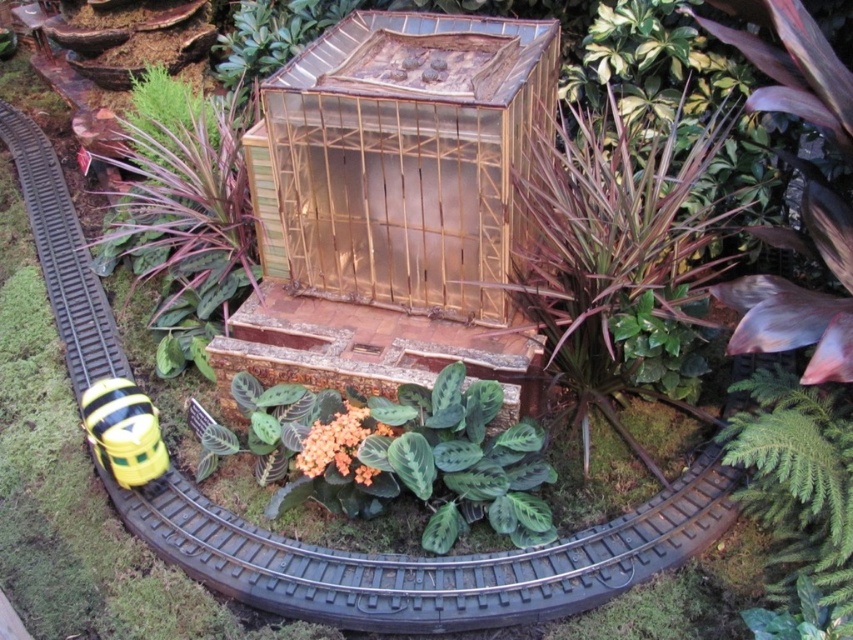
Question: Observing the image, what is the correct spatial positioning of transparent bamboo cage at center in reference to yellow matte toy at lower left?

Choices:
 (A) below
 (B) above

Answer: (B)

Question: Can you confirm if transparent bamboo cage at center is bigger than yellow matte toy at lower left?

Choices:
 (A) no
 (B) yes

Answer: (B)

Question: Estimate the real-world distances between objects in this image. Which object is farther from the transparent bamboo cage at center?

Choices:
 (A) green leafy fern at lower right
 (B) yellow matte toy at lower left

Answer: (A)

Question: Among these points, which one is farthest from the camera?

Choices:
 (A) (154, 456)
 (B) (821, 513)

Answer: (A)

Question: Is transparent bamboo cage at center to the left of green leafy fern at lower right from the viewer's perspective?

Choices:
 (A) yes
 (B) no

Answer: (A)

Question: Which point appears closest to the camera in this image?

Choices:
 (A) (83, 422)
 (B) (814, 548)
 (C) (285, 161)

Answer: (B)